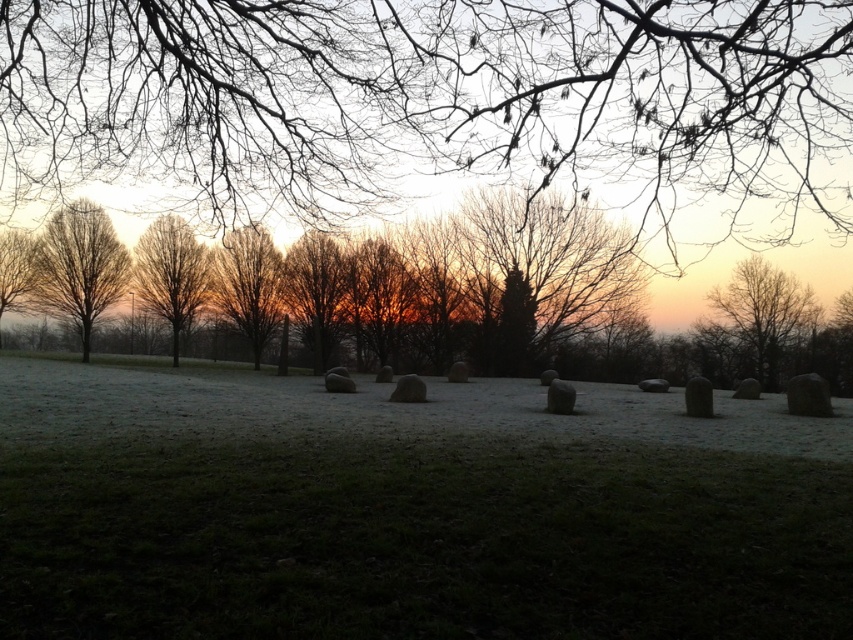
Does bare wood tree at right have a smaller size compared to smooth bark tree at left?

Actually, bare wood tree at right might be larger than smooth bark tree at left.

Is point (814, 321) in front of point (28, 300)?

No, it is behind (28, 300).

This screenshot has height=640, width=853. Identify the location of bare wood tree at right. (763, 314).

Measure the distance between brown textured tree at center and bare wood tree at center.

brown textured tree at center is 20.04 feet from bare wood tree at center.

Is brown textured tree at center bigger than bare wood tree at center?

Indeed, brown textured tree at center has a larger size compared to bare wood tree at center.

Is point (317, 333) less distant than point (138, 275)?

Yes, point (317, 333) is in front of point (138, 275).

Where is `brown textured tree at center`? This screenshot has height=640, width=853. brown textured tree at center is located at coordinates (316, 294).

Which is more to the left, bare wood tree at right or brown textured tree at center?

Positioned to the left is brown textured tree at center.

Between point (799, 316) and point (312, 275), which one is positioned behind?

Positioned behind is point (312, 275).

Is point (785, 324) farther from viewer compared to point (345, 269)?

That is False.

This screenshot has width=853, height=640. I want to click on bare wood tree at right, so click(763, 314).